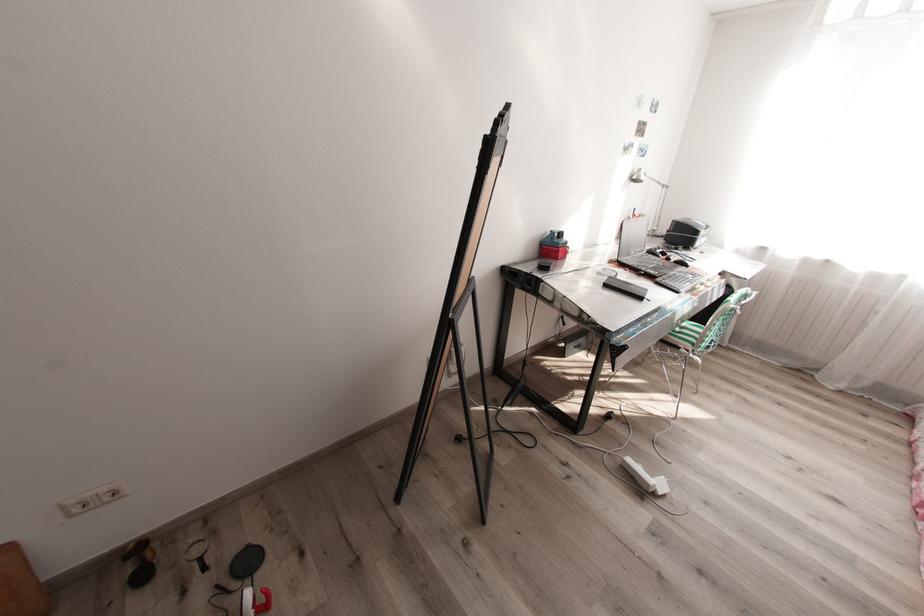
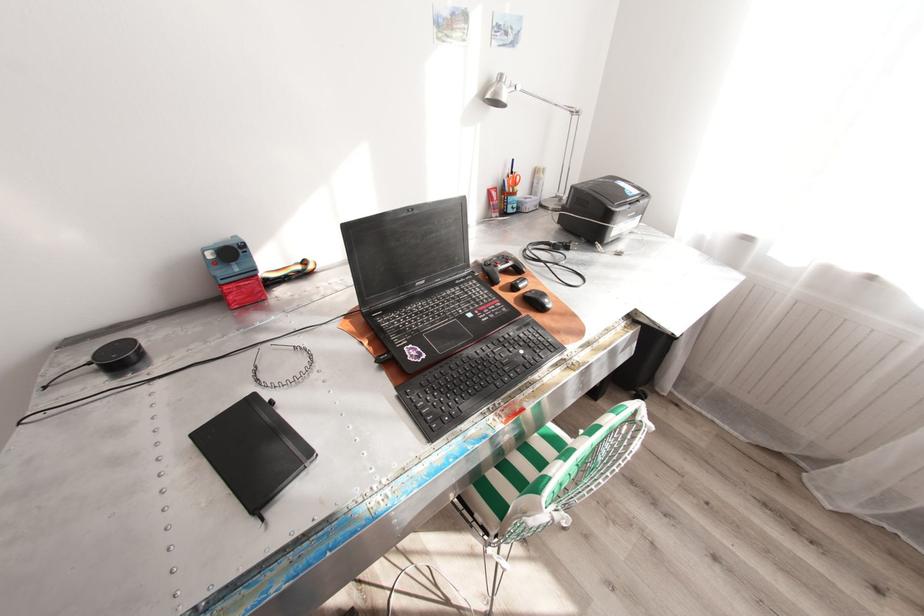
In the second image, find the point that corresponds to [689,265] in the first image.

(545, 308)